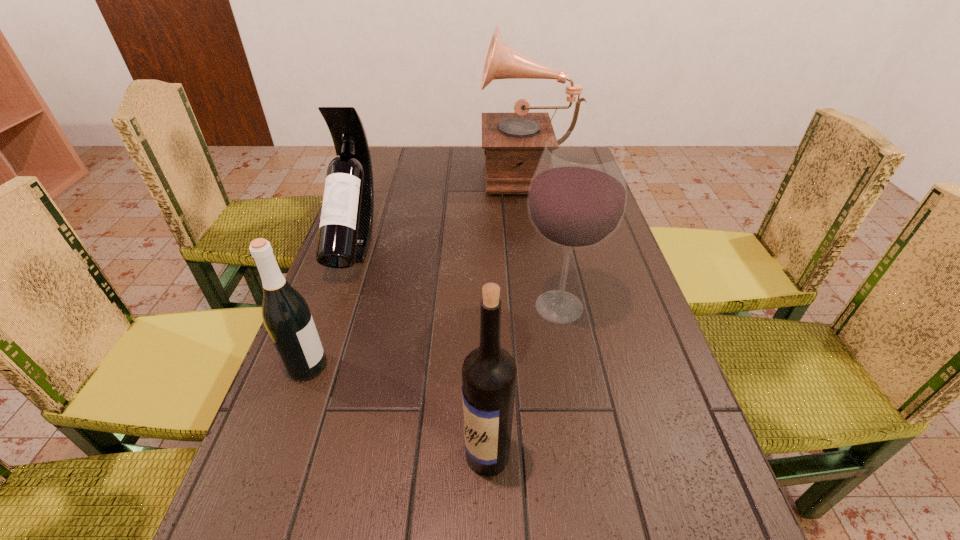
Image resolution: width=960 pixels, height=540 pixels. Find the location of `free space at the left edge of the desktop`. free space at the left edge of the desktop is located at coordinates (279, 438).

Identify the location of vacant area at the right edge. This screenshot has height=540, width=960. (645, 335).

Where is `free area in between the alcohol and the farthest wine bottle`? This screenshot has width=960, height=540. free area in between the alcohol and the farthest wine bottle is located at coordinates (457, 274).

Where is `free spot between the farthest wine bottle and the record player`? free spot between the farthest wine bottle and the record player is located at coordinates (441, 207).

The width and height of the screenshot is (960, 540). What are the coordinates of `free space between the farthest wine bottle and the second nearest wine bottle` in the screenshot? It's located at (330, 304).

Locate an element on the screen. free spot between the second nearest object and the farthest object is located at coordinates (417, 268).

You are a GUI agent. You are given a task and a screenshot of the screen. Output one action in this format:
    pyautogui.click(x=<x>, y=<y>)
    Task: Click on the vacant region between the alcohol and the record player
    This screenshot has height=540, width=960.
    Given the screenshot: What is the action you would take?
    pyautogui.click(x=542, y=239)

Identify the location of free point between the record player and the alcohol. (542, 239).

The width and height of the screenshot is (960, 540). What are the coordinates of `vacant space in between the nearest wine bottle and the alcohol` in the screenshot? It's located at (523, 381).

You are a GUI agent. You are given a task and a screenshot of the screen. Output one action in this format:
    pyautogui.click(x=<x>, y=<y>)
    Task: Click on the free point between the second nearest object and the alcohol
    Image resolution: width=960 pixels, height=540 pixels.
    Given the screenshot: What is the action you would take?
    pyautogui.click(x=433, y=336)